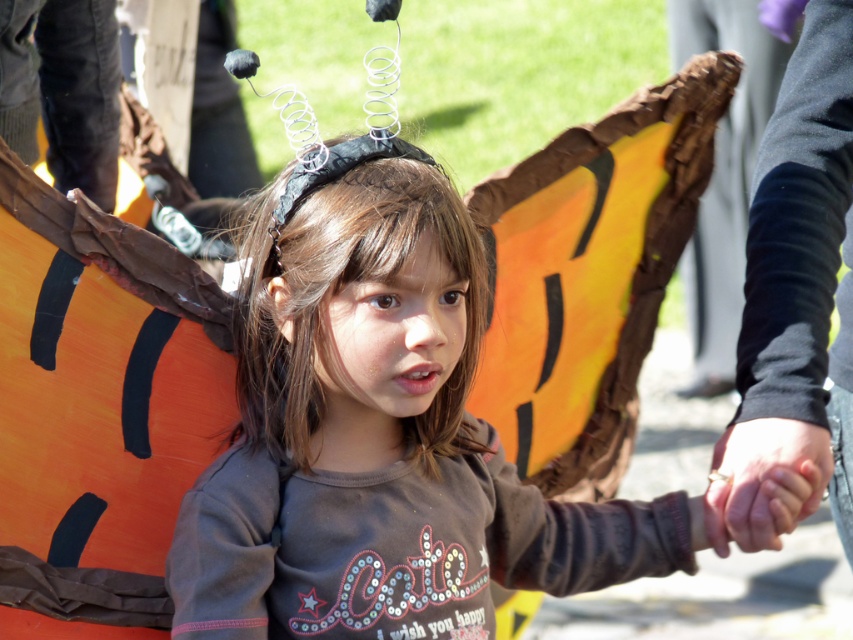
Which of these two, matte brown shirt at center or smooth skin hand at center, stands taller?

With more height is matte brown shirt at center.

Who is more forward, [347,324] or [808,492]?

Point [808,492] is more forward.

Describe the element at coordinates (386, 449) in the screenshot. I see `matte brown shirt at center` at that location.

This screenshot has height=640, width=853. Identify the location of matte brown shirt at center. tap(386, 449).